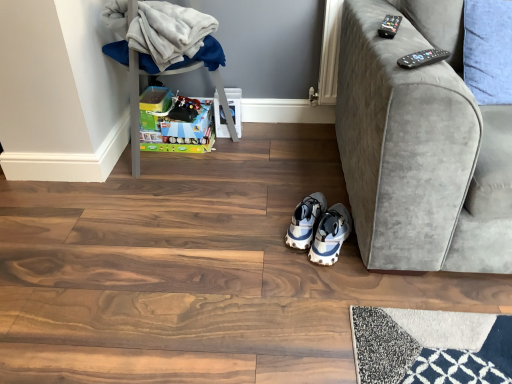
Question: Considering the relative sizes of blue fabric pillow at upper right and black plastic remote at upper right, the first remote when ordered from back to front, in the image provided, is blue fabric pillow at upper right smaller than black plastic remote at upper right, the first remote when ordered from back to front,?

Choices:
 (A) yes
 (B) no

Answer: (B)

Question: Is blue fabric pillow at upper right at the left side of black plastic remote at upper right, the second remote from the front?

Choices:
 (A) no
 (B) yes

Answer: (A)

Question: Is blue fabric pillow at upper right outside of black plastic remote at upper right, the first remote when ordered from back to front?

Choices:
 (A) no
 (B) yes

Answer: (B)

Question: From a real-world perspective, is blue fabric pillow at upper right physically below black plastic remote at upper right, the second remote when ordered from bottom to top?

Choices:
 (A) no
 (B) yes

Answer: (B)

Question: Can you confirm if blue fabric pillow at upper right is shorter than black plastic remote at upper right, the 1th remote viewed from the top?

Choices:
 (A) no
 (B) yes

Answer: (A)

Question: From their relative heights in the image, would you say black plastic remote at upper right, placed as the 1th remote when sorted from front to back, is taller or shorter than blue and white textured sneakers at center, marked as the 2th footwear in a right-to-left arrangement?

Choices:
 (A) tall
 (B) short

Answer: (B)

Question: Considering their positions, is black plastic remote at upper right, which is the 1th remote from bottom to top, located in front of or behind blue and white textured sneakers at center, marked as the 2th footwear in a right-to-left arrangement?

Choices:
 (A) behind
 (B) front

Answer: (B)

Question: Based on their positions, is black plastic remote at upper right, which is the 1th remote from bottom to top, located to the left or right of blue and white textured sneakers at center, marked as the 2th footwear in a right-to-left arrangement?

Choices:
 (A) right
 (B) left

Answer: (A)

Question: From the image's perspective, is black plastic remote at upper right, which is the 1th remote from bottom to top, above or below blue and white textured sneakers at center, the first footwear positioned from the left?

Choices:
 (A) below
 (B) above

Answer: (B)

Question: Is white mesh sneakers at lower center, the 1th footwear when ordered from right to left, to the left or to the right of blue and white textured sneakers at center, marked as the 2th footwear in a right-to-left arrangement, in the image?

Choices:
 (A) left
 (B) right

Answer: (B)

Question: From a real-world perspective, is white mesh sneakers at lower center, the 2th footwear when ordered from left to right, positioned above or below blue and white textured sneakers at center, marked as the 2th footwear in a right-to-left arrangement?

Choices:
 (A) above
 (B) below

Answer: (B)

Question: Looking at their shapes, would you say white mesh sneakers at lower center, the 1th footwear when ordered from right to left, is wider or thinner than blue and white textured sneakers at center, the first footwear positioned from the left?

Choices:
 (A) wide
 (B) thin

Answer: (A)

Question: Do you think white mesh sneakers at lower center, the 1th footwear when ordered from right to left, is within blue and white textured sneakers at center, marked as the 2th footwear in a right-to-left arrangement, or outside of it?

Choices:
 (A) outside
 (B) inside

Answer: (A)

Question: Is point (103, 16) closer or farther from the camera than point (497, 41)?

Choices:
 (A) closer
 (B) farther

Answer: (B)

Question: Is plastic storage box at left wider or thinner than blue fabric pillow at upper right?

Choices:
 (A) thin
 (B) wide

Answer: (B)